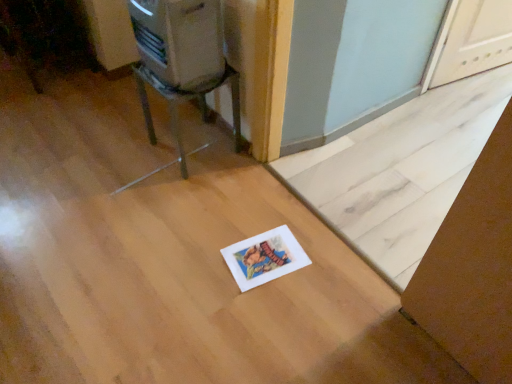
Locate an element on the screen. blank area to the left of metallic silver chair at upper left is located at coordinates (132, 147).